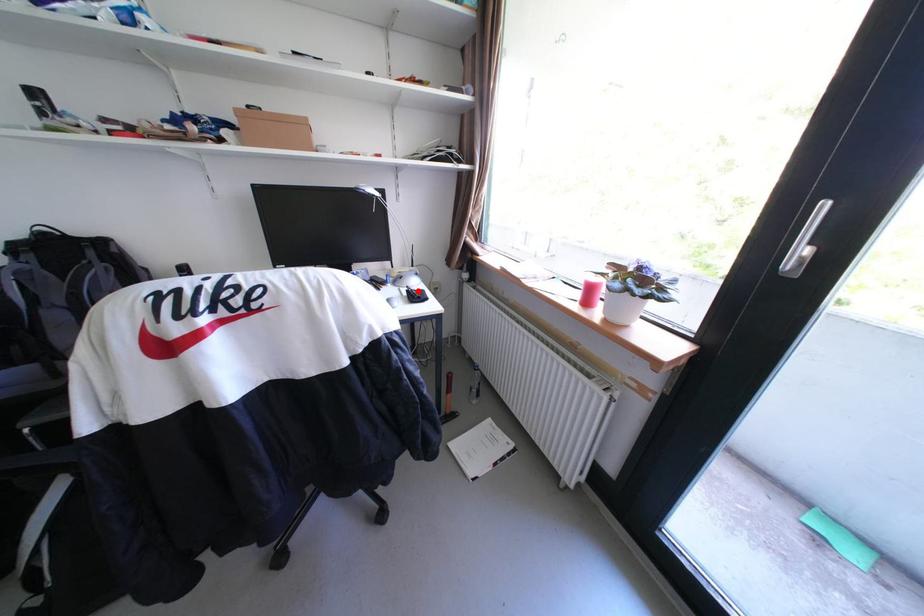
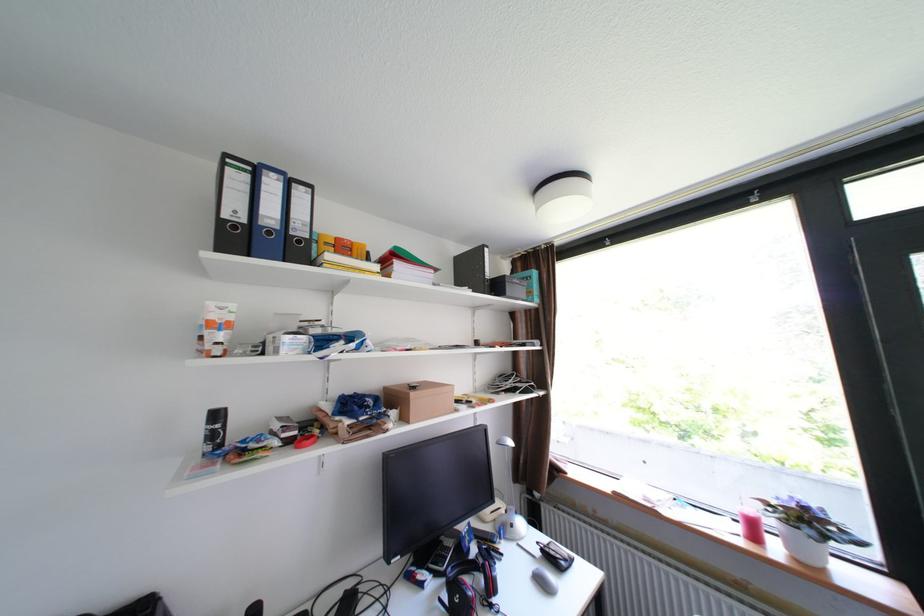
Find the pixel in the second image that matches the highlighted location in the first image.

(553, 551)